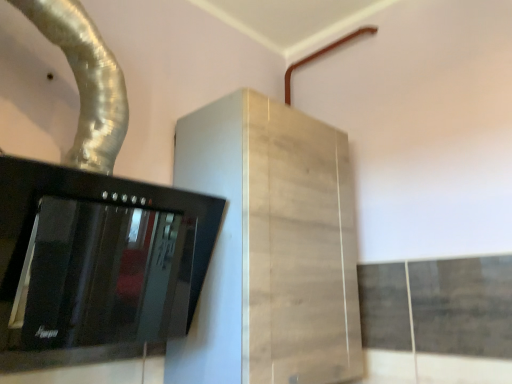
Question: From a real-world perspective, is silver metallic duct at upper left located beneath black glass stove at left?

Choices:
 (A) no
 (B) yes

Answer: (A)

Question: Considering the relative positions of silver metallic duct at upper left and black glass stove at left in the image provided, is silver metallic duct at upper left to the left of black glass stove at left from the viewer's perspective?

Choices:
 (A) yes
 (B) no

Answer: (A)

Question: From a real-world perspective, is silver metallic duct at upper left positioned over black glass stove at left based on gravity?

Choices:
 (A) yes
 (B) no

Answer: (A)

Question: Is silver metallic duct at upper left behind black glass stove at left?

Choices:
 (A) yes
 (B) no

Answer: (A)

Question: Can black glass stove at left be found inside silver metallic duct at upper left?

Choices:
 (A) yes
 (B) no

Answer: (B)

Question: Is silver metallic duct at upper left inside the boundaries of black glass stove at left, or outside?

Choices:
 (A) inside
 (B) outside

Answer: (B)

Question: In the image, is silver metallic duct at upper left positioned in front of or behind black glass stove at left?

Choices:
 (A) behind
 (B) front

Answer: (A)

Question: From the image's perspective, relative to black glass stove at left, is silver metallic duct at upper left above or below?

Choices:
 (A) below
 (B) above

Answer: (B)

Question: Considering the positions of silver metallic duct at upper left and black glass stove at left in the image, is silver metallic duct at upper left taller or shorter than black glass stove at left?

Choices:
 (A) tall
 (B) short

Answer: (A)

Question: Choose the correct answer: Is silver metallic duct at upper left inside brown matte pipe at upper right or outside it?

Choices:
 (A) inside
 (B) outside

Answer: (B)

Question: Is silver metallic duct at upper left bigger or smaller than brown matte pipe at upper right?

Choices:
 (A) small
 (B) big

Answer: (B)

Question: In terms of width, does silver metallic duct at upper left look wider or thinner when compared to brown matte pipe at upper right?

Choices:
 (A) wide
 (B) thin

Answer: (A)

Question: From a real-world perspective, is silver metallic duct at upper left physically located above or below brown matte pipe at upper right?

Choices:
 (A) above
 (B) below

Answer: (B)

Question: In terms of size, does light wood cabinet at center appear bigger or smaller than silver metallic duct at upper left?

Choices:
 (A) small
 (B) big

Answer: (B)

Question: Considering the positions of light wood cabinet at center and silver metallic duct at upper left in the image, is light wood cabinet at center taller or shorter than silver metallic duct at upper left?

Choices:
 (A) tall
 (B) short

Answer: (A)